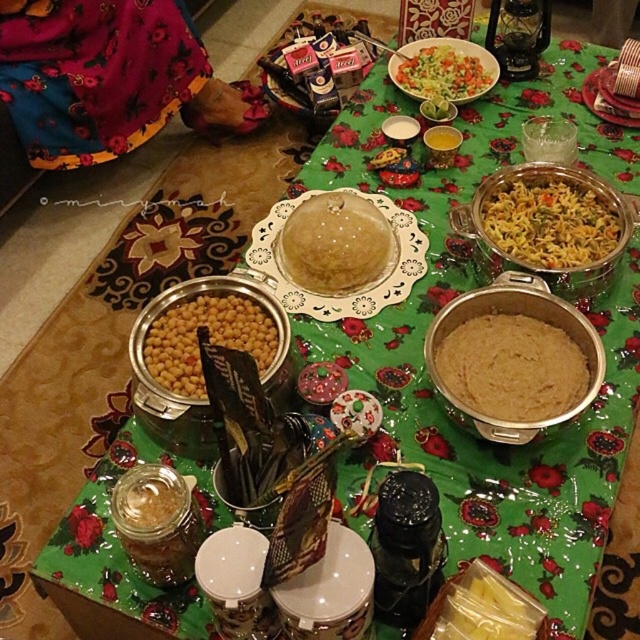
Can you confirm if translucent glass dome at center is positioned below green leafy salad at center?

Correct, translucent glass dome at center is located below green leafy salad at center.

Is point (371, 276) positioned after point (461, 84)?

No, it is not.

This screenshot has height=640, width=640. What are the coordinates of `translucent glass dome at center` in the screenshot? It's located at (336, 243).

Looking at this image, does floral fabric skirt at upper left have a lesser width compared to green leafy salad at center?

In fact, floral fabric skirt at upper left might be wider than green leafy salad at center.

Can you confirm if floral fabric skirt at upper left is bigger than green leafy salad at center?

Yes, floral fabric skirt at upper left is bigger than green leafy salad at center.

Which is behind, point (40, 83) or point (440, 70)?

Point (40, 83)

You are a GUI agent. You are given a task and a screenshot of the screen. Output one action in this format:
    pyautogui.click(x=<x>, y=<y>)
    Task: Click on the floral fabric skirt at upper left
    Image resolution: width=640 pixels, height=640 pixels.
    Given the screenshot: What is the action you would take?
    pyautogui.click(x=108, y=77)

Does translucent glass dome at center lie in front of translucent plastic bag at center?

No, it is not.

Is point (317, 282) more distant than point (492, 621)?

Yes.

Locate an element on the screen. translucent glass dome at center is located at coordinates (336, 243).